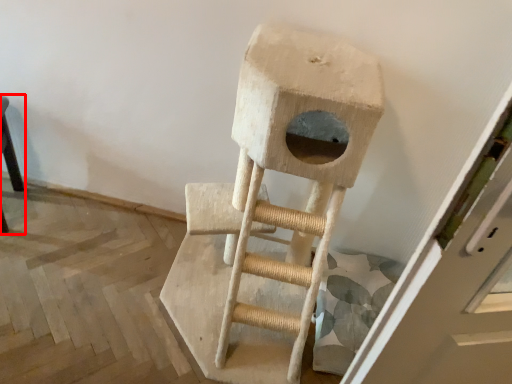
Question: From the image's perspective, what is the correct spatial positioning of furniture (annotated by the red box) in reference to ladder?

Choices:
 (A) below
 (B) above

Answer: (B)